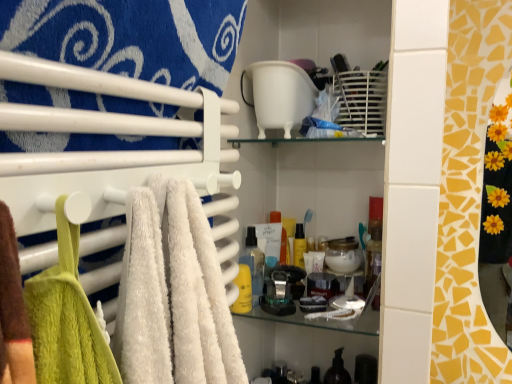
Question: In terms of height, does yellow matte bottle at center, the 1th toiletry when ordered from left to right, look taller or shorter compared to translucent plastic spray bottle at center, the second toiletry from the front?

Choices:
 (A) short
 (B) tall

Answer: (A)

Question: From the image's perspective, is yellow matte bottle at center, the third toiletry positioned from the right, located above or below translucent plastic spray bottle at center, which is the second toiletry from left to right?

Choices:
 (A) below
 (B) above

Answer: (A)

Question: Which object is positioned closest to the translucent plastic soap dispenser at lower center, positioned as the 3th toiletry in top-to-bottom order?

Choices:
 (A) translucent plastic spray bottle at center, the second toiletry from the front
 (B) white soft towel at left
 (C) yellow matte bottle at center, the 1th toiletry when ordered from left to right

Answer: (C)

Question: Estimate the real-world distances between objects in this image. Which object is farther from the white soft towel at left?

Choices:
 (A) yellow matte bottle at center, positioned as the 3th toiletry in back-to-front order
 (B) translucent plastic spray bottle at center, which is the 2th toiletry in back-to-front order
 (C) translucent plastic soap dispenser at lower center, positioned as the 3th toiletry in top-to-bottom order

Answer: (C)